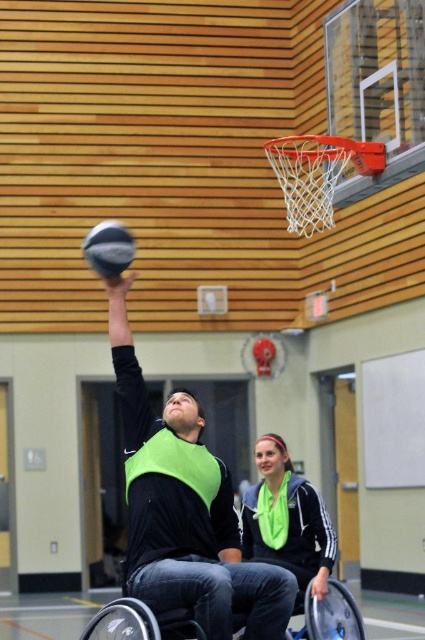
Can you confirm if green fabric scarf at center is taller than silver metallic wheelchair at center?

Indeed, green fabric scarf at center has a greater height compared to silver metallic wheelchair at center.

Describe the element at coordinates (286, 520) in the screenshot. I see `green fabric scarf at center` at that location.

Locate an element on the screen. This screenshot has width=425, height=640. green fabric scarf at center is located at coordinates (286, 520).

Who is positioned more to the left, rubber textured basketball at center or metallic silver basketball hoop at center?

From the viewer's perspective, rubber textured basketball at center appears more on the left side.

This screenshot has width=425, height=640. What do you see at coordinates (108, 248) in the screenshot?
I see `rubber textured basketball at center` at bounding box center [108, 248].

Who is more distant from viewer, [107,243] or [282,362]?

The point [282,362] is behind.

Locate an element on the screen. This screenshot has height=640, width=425. rubber textured basketball at center is located at coordinates (108, 248).

Who is positioned more to the right, green fabric scarf at center or rubber textured basketball at center?

From the viewer's perspective, green fabric scarf at center appears more on the right side.

Where is `green fabric scarf at center`? This screenshot has height=640, width=425. green fabric scarf at center is located at coordinates (286, 520).

This screenshot has height=640, width=425. I want to click on green fabric scarf at center, so click(286, 520).